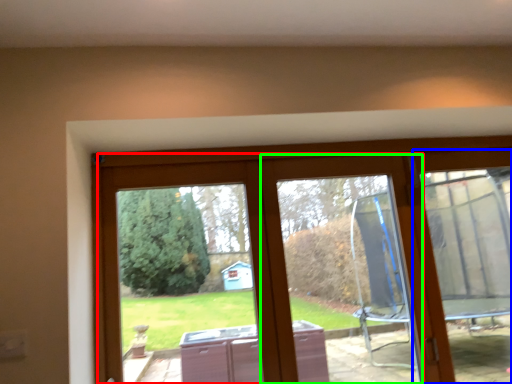
Question: Which object is positioned closest to glass door (highlighted by a red box)? Select from screen door (highlighted by a blue box) and window frame (highlighted by a green box).

Choices:
 (A) screen door
 (B) window frame

Answer: (B)